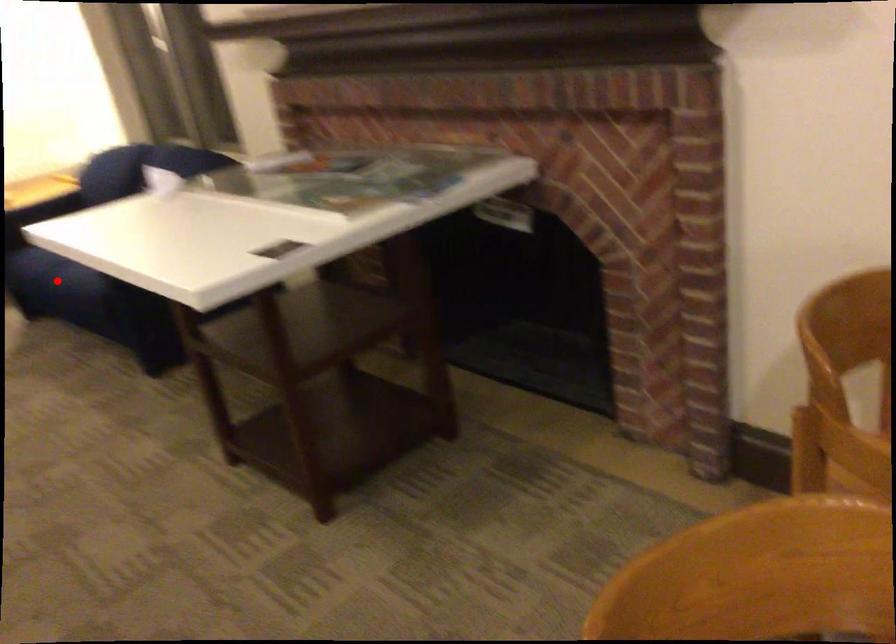
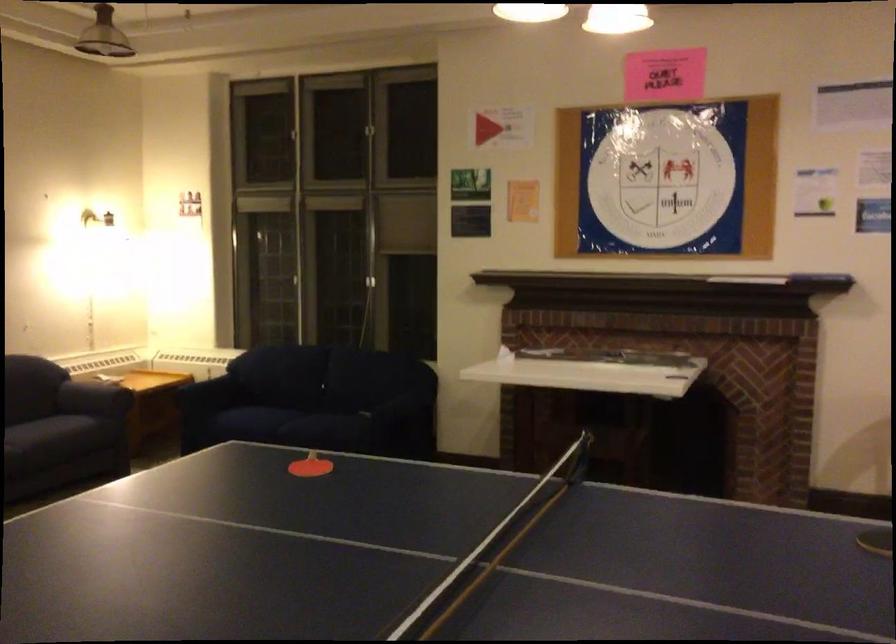
Question: I am providing you with two images of the same scene from different viewpoints. A red point is marked on the first image. At the location where the point appears in image 1, is it still visible in image 2?

Choices:
 (A) Yes
 (B) No

Answer: (B)